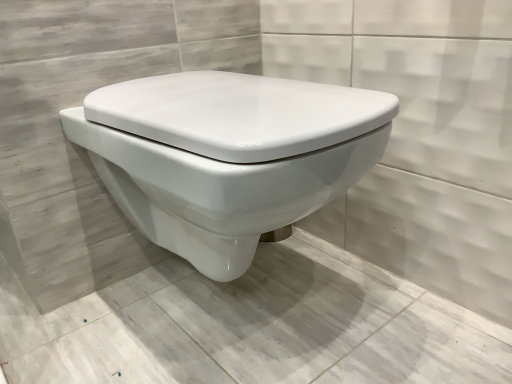
You are a GUI agent. You are given a task and a screenshot of the screen. Output one action in this format:
    pyautogui.click(x=<x>, y=<y>)
    Task: Click on the free space above white glossy toilet at center (from a real-world perspective)
    
    Given the screenshot: What is the action you would take?
    pyautogui.click(x=205, y=307)